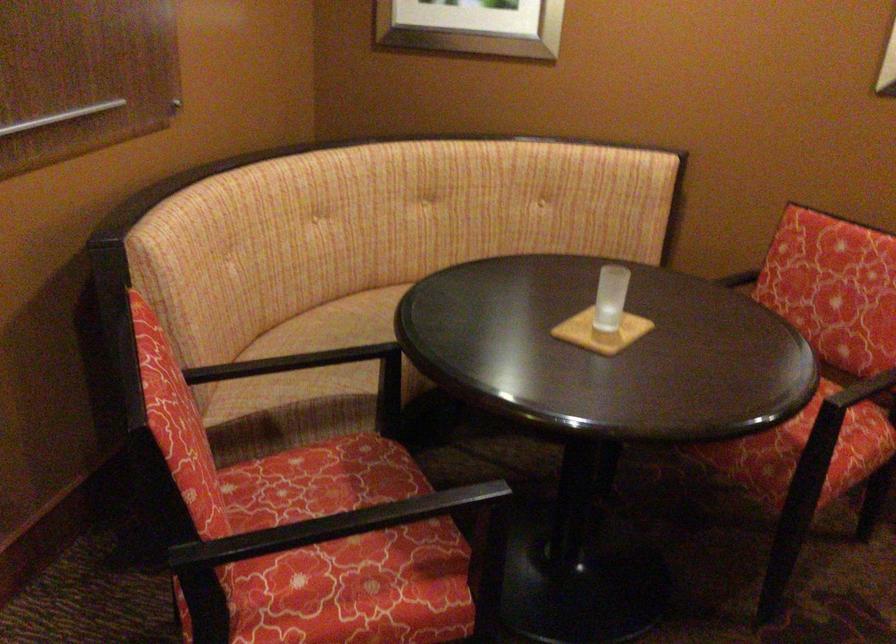
Find where to sit the sofa sitting surface. Please return your answer as a coordinate pair (x, y).

(332, 327)